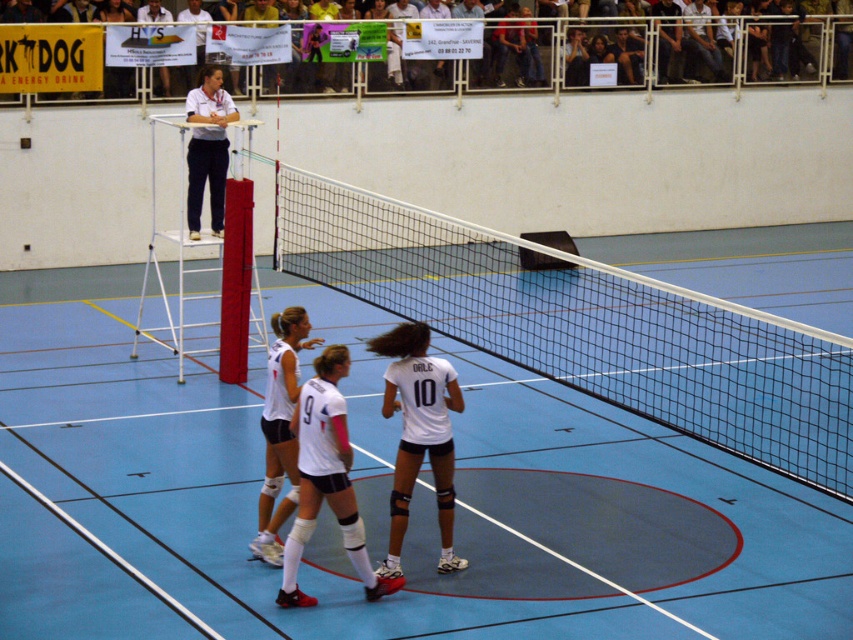
Question: Which object is positioned farthest from the blue rubber volleyball court at center?

Choices:
 (A) white matte shorts at center
 (B) white matte uniform at center

Answer: (B)

Question: Can you confirm if blue rubber volleyball court at center is positioned below white mesh net at center?

Choices:
 (A) yes
 (B) no

Answer: (A)

Question: Among these points, which one is nearest to the camera?

Choices:
 (A) (405, 416)
 (B) (374, 582)
 (C) (741, 346)
 (D) (294, 320)

Answer: (B)

Question: Which point is closer to the camera?

Choices:
 (A) tap(508, 436)
 (B) tap(285, 403)
 (C) tap(335, 470)

Answer: (C)

Question: Can you confirm if blue rubber volleyball court at center is thinner than white matte shorts at center?

Choices:
 (A) yes
 (B) no

Answer: (B)

Question: Where is blue rubber volleyball court at center located in relation to white matte shorts at center in the image?

Choices:
 (A) above
 (B) below

Answer: (A)